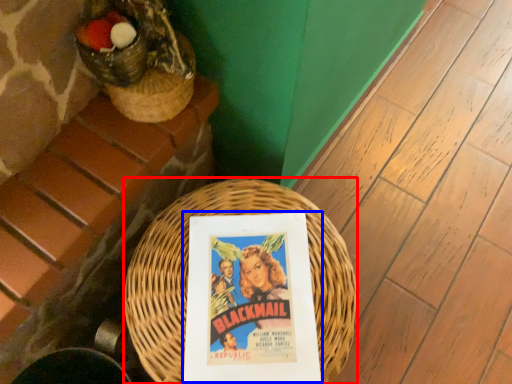
Question: Among these objects, which one is nearest to the camera, basket (highlighted by a red box) or paperback book (highlighted by a blue box)?

Choices:
 (A) basket
 (B) paperback book

Answer: (A)